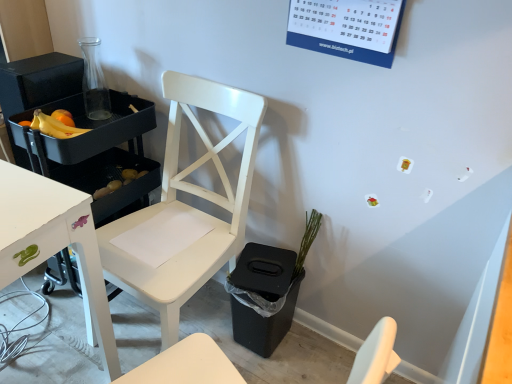
Question: Is white matte chair at center completely or partially inside yellow matte bananas at left?

Choices:
 (A) yes
 (B) no

Answer: (B)

Question: Is yellow matte bananas at left shorter than white matte chair at center?

Choices:
 (A) no
 (B) yes

Answer: (B)

Question: From a real-world perspective, is yellow matte bananas at left under white matte chair at center?

Choices:
 (A) yes
 (B) no

Answer: (B)

Question: Is yellow matte bananas at left facing away from white matte chair at center?

Choices:
 (A) yes
 (B) no

Answer: (B)

Question: Can you confirm if yellow matte bananas at left is bigger than white matte chair at center?

Choices:
 (A) no
 (B) yes

Answer: (A)

Question: From a real-world perspective, is yellow matte potatoes at lower left positioned above or below white matte chair at center?

Choices:
 (A) below
 (B) above

Answer: (A)

Question: Would you say yellow matte potatoes at lower left is to the left or to the right of white matte chair at center in the picture?

Choices:
 (A) right
 (B) left

Answer: (B)

Question: Which is correct: yellow matte potatoes at lower left is inside white matte chair at center, or outside of it?

Choices:
 (A) inside
 (B) outside

Answer: (B)

Question: From the image's perspective, is yellow matte potatoes at lower left positioned above or below white matte chair at center?

Choices:
 (A) above
 (B) below

Answer: (A)

Question: Considering the positions of green matte plant at lower center and yellow matte potatoes at lower left in the image, is green matte plant at lower center wider or thinner than yellow matte potatoes at lower left?

Choices:
 (A) thin
 (B) wide

Answer: (A)

Question: In the image, is green matte plant at lower center on the left side or the right side of yellow matte potatoes at lower left?

Choices:
 (A) right
 (B) left

Answer: (A)

Question: From their relative heights in the image, would you say green matte plant at lower center is taller or shorter than yellow matte potatoes at lower left?

Choices:
 (A) short
 (B) tall

Answer: (B)

Question: Is point (293, 271) positioned closer to the camera than point (139, 173)?

Choices:
 (A) closer
 (B) farther

Answer: (A)

Question: Is yellow matte potatoes at lower left in front of or behind yellow matte bananas at left in the image?

Choices:
 (A) behind
 (B) front

Answer: (A)

Question: Looking at the image, does yellow matte potatoes at lower left seem bigger or smaller compared to yellow matte bananas at left?

Choices:
 (A) small
 (B) big

Answer: (B)